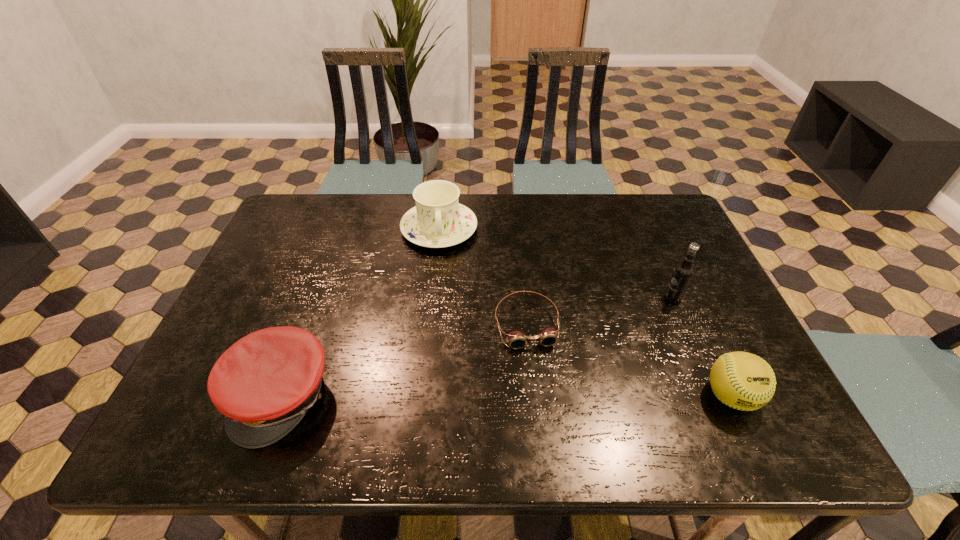
At what (x,y) coordinates should I click in order to perform the action: click on free area in between the third object from right to left and the fourth object from right to left. Please return your answer as a coordinate pair (x, y). Looking at the image, I should click on (483, 276).

Locate an element on the screen. The width and height of the screenshot is (960, 540). vacant space that's between the cap and the chinaware is located at coordinates (360, 313).

The height and width of the screenshot is (540, 960). What are the coordinates of `free spot between the tallest object and the softball` in the screenshot? It's located at (702, 346).

Find the location of `vacant space that is in between the shortest object and the root beer`. vacant space that is in between the shortest object and the root beer is located at coordinates (600, 310).

Find the location of a particular element. This screenshot has height=540, width=960. free space between the softball and the root beer is located at coordinates (702, 346).

This screenshot has width=960, height=540. I want to click on free space between the cap and the farthest object, so click(360, 313).

Identify the location of vacant area between the softball and the root beer. The height and width of the screenshot is (540, 960). (702, 346).

This screenshot has width=960, height=540. I want to click on empty space between the farthest object and the goggles, so click(x=483, y=276).

Identify the location of unoccupied area between the cap and the root beer. Image resolution: width=960 pixels, height=540 pixels. (477, 346).

Find the location of a particular element. The width and height of the screenshot is (960, 540). vacant space that is in between the root beer and the leftmost object is located at coordinates (477, 346).